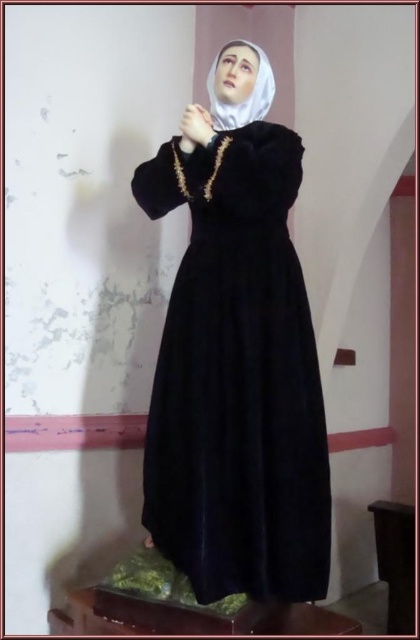
Question: Is velvet black dress at center behind white matte veil at center?

Choices:
 (A) no
 (B) yes

Answer: (A)

Question: Is velvet black dress at center smaller than white matte veil at center?

Choices:
 (A) no
 (B) yes

Answer: (A)

Question: Estimate the real-world distances between objects in this image. Which object is closer to the matte black hand at center?

Choices:
 (A) velvet black dress at center
 (B) white matte veil at center

Answer: (B)

Question: Is velvet black dress at center further to the viewer compared to matte black hand at center?

Choices:
 (A) yes
 (B) no

Answer: (B)

Question: Which object appears farthest from the camera in this image?

Choices:
 (A) matte black hand at center
 (B) white matte veil at center

Answer: (B)

Question: Based on their relative distances, which object is farther from the velvet black dress at center?

Choices:
 (A) white matte veil at center
 (B) matte black hand at center

Answer: (A)